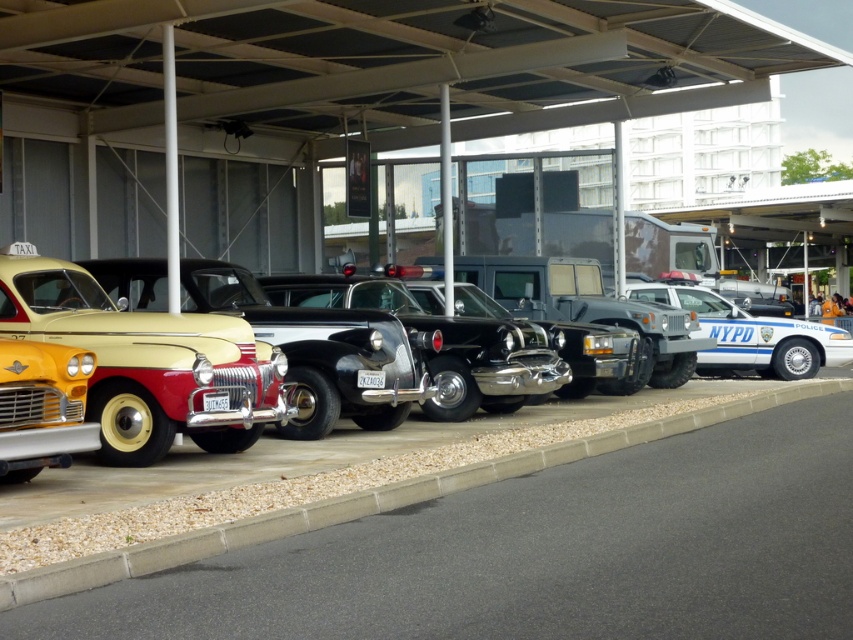
You are standing at the entrance of the exhibition hall and want to locate the matte yellow taxi at left. According to the coordinates provided, where should you look to find it?

The matte yellow taxi at left is located at coordinates point (144,362).

You are a visitor at the exhibition and want to take a photo of the matte yellow taxi at left. However, the shiny chrome pickup truck at center is blocking your view. Can you move the pickup truck to get a clear shot?

The matte yellow taxi at left is positioned under the shiny chrome pickup truck at center, so moving the pickup truck would allow you to take a clear photo of the taxi.

You are a tour guide explaining the vehicles to visitors. You need to mention both the shiny chrome car at center and the shiny chrome pickup truck at center. Which one is wider?

The shiny chrome pickup truck at center is wider than the shiny chrome car at center.